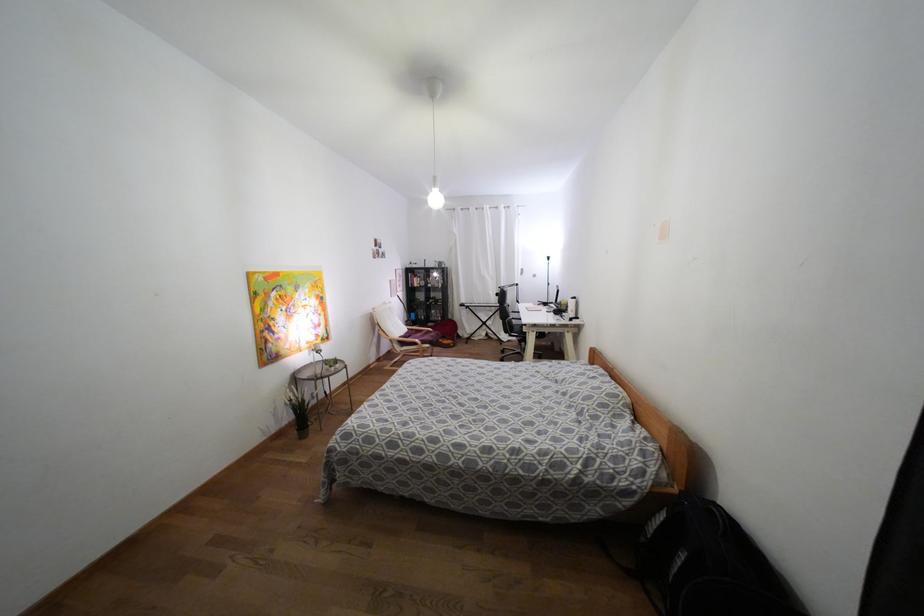
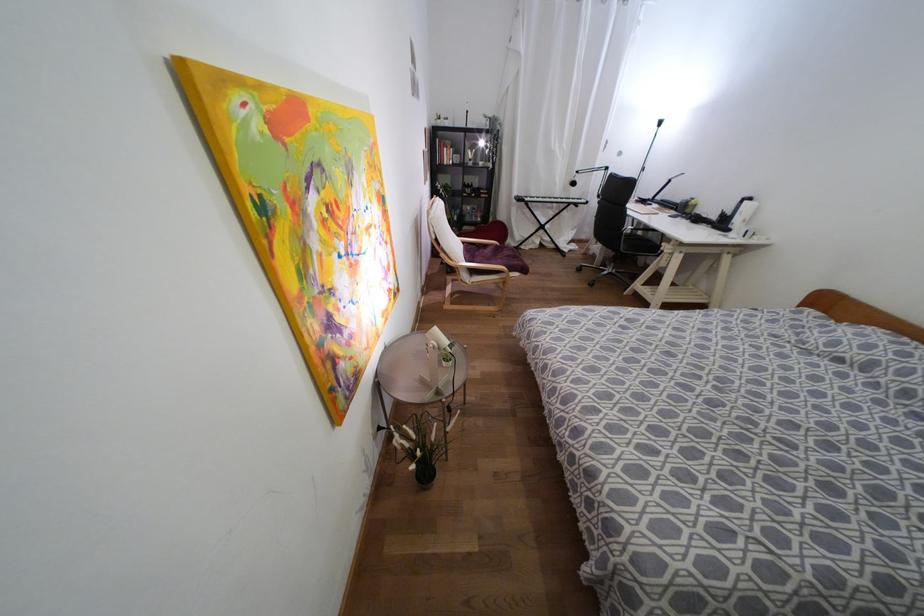
Where in the second image is the point corresponding to (x=434, y=274) from the first image?

(480, 143)